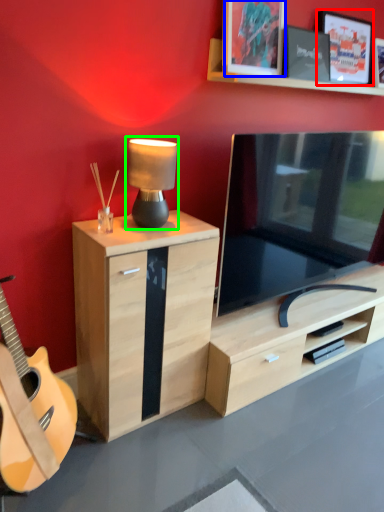
Question: Which object is positioned farthest from picture frame (highlighted by a red box)? Select from picture frame (highlighted by a blue box) and table lamp (highlighted by a green box).

Choices:
 (A) picture frame
 (B) table lamp

Answer: (B)